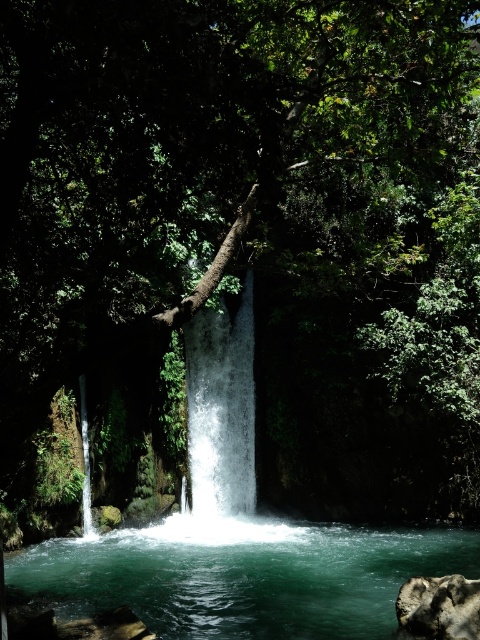
From the picture: You are a photographer trying to capture the waterfall. You notice two types of water in the scene. Which one is positioned to the right of the other? Specifically, is the clear water at center located to the right or left of the white frothy water at center?

The clear water at center is to the right of the white frothy water at center.